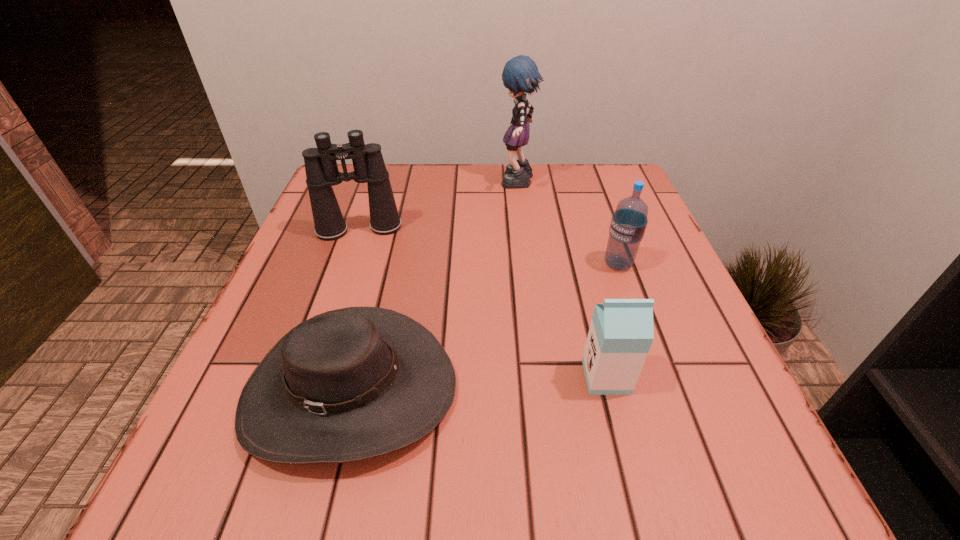
At what (x,y) coordinates should I click in order to perform the action: click on the tallest object. Please return your answer as a coordinate pair (x, y). This screenshot has width=960, height=540. Looking at the image, I should click on (520, 75).

Find the location of `rag doll`. rag doll is located at coordinates (520, 75).

Where is `binoculars`? The width and height of the screenshot is (960, 540). binoculars is located at coordinates (322, 173).

The height and width of the screenshot is (540, 960). I want to click on the fourth nearest object, so click(322, 173).

The height and width of the screenshot is (540, 960). In order to click on the third nearest object in this screenshot , I will do `click(629, 221)`.

Identify the location of the rightmost object. (629, 221).

Identify the location of the second object from right to left. (621, 332).

You are a GUI agent. You are given a task and a screenshot of the screen. Output one action in this format:
    pyautogui.click(x=<x>, y=<y>)
    Task: Click on the shortest object
    
    Given the screenshot: What is the action you would take?
    pyautogui.click(x=350, y=384)

The image size is (960, 540). Identify the location of vacant point located 0.310m on the front-facing side of the tallest object. (376, 184).

The width and height of the screenshot is (960, 540). What are the coordinates of `vacant space located 0.080m on the front-facing side of the tallest object` in the screenshot? It's located at (468, 184).